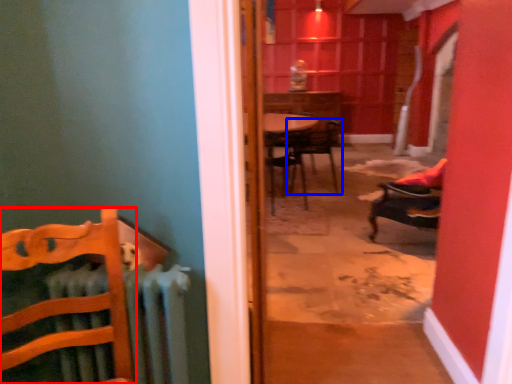
Question: Which object appears closest to the camera in this image, chair (highlighted by a red box) or chair (highlighted by a blue box)?

Choices:
 (A) chair
 (B) chair

Answer: (A)